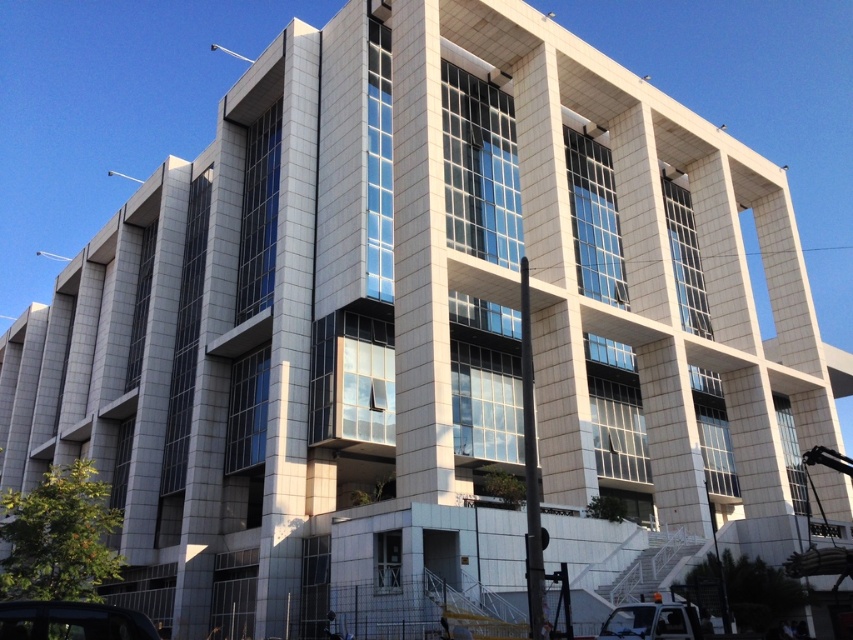
Question: Which object appears farthest from the camera in this image?

Choices:
 (A) shiny black car at lower left
 (B) metallic silver car at lower right

Answer: (B)

Question: Which point is closer to the camera taking this photo?

Choices:
 (A) (650, 632)
 (B) (85, 612)

Answer: (B)

Question: Is shiny black car at lower left positioned before metallic silver car at lower right?

Choices:
 (A) yes
 (B) no

Answer: (A)

Question: Does shiny black car at lower left have a smaller size compared to metallic silver car at lower right?

Choices:
 (A) yes
 (B) no

Answer: (B)

Question: Can you confirm if shiny black car at lower left is positioned to the right of metallic silver car at lower right?

Choices:
 (A) no
 (B) yes

Answer: (A)